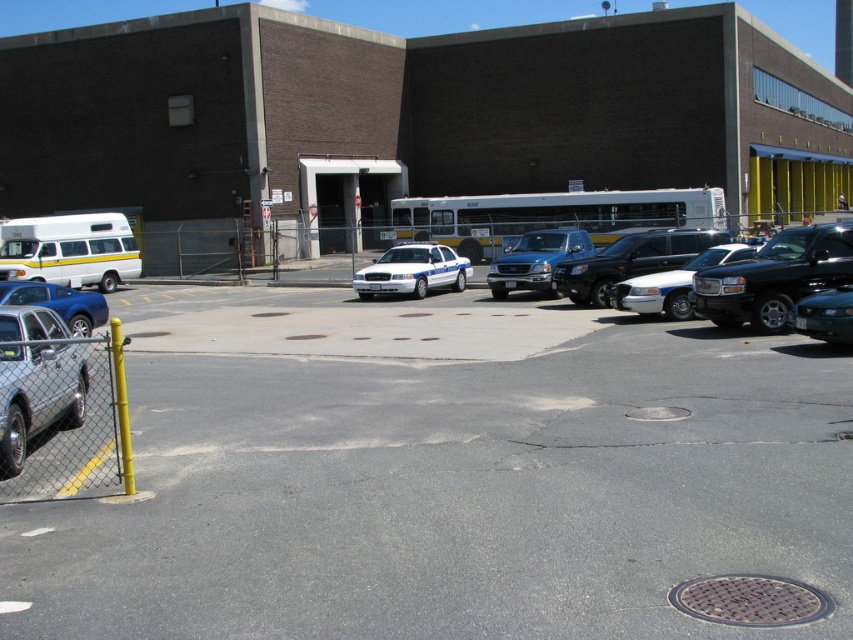
Consider the image. You are standing in front of the industrial building and want to walk to the satin black truck at center. Is the gray asphalt parking lot at center between you and the truck?

Yes, the gray asphalt parking lot at center is between you and the satin black truck at center because the parking lot is closer to the viewer than the truck.

You are a delivery driver who needs to exit the parking lot. You see the silver metallic sedan at left and the white matte van at left. Which vehicle is blocking your path closer to you?

The silver metallic sedan at left is blocking your path closer to you because it is in front of the white matte van at left.

You are a delivery driver who needs to park your 2.5 meter tall truck in the parking lot. Based on the scene, can your truck fit vertically in the parking space between the gray asphalt parking lot at center and the satin black truck at center?

The gray asphalt parking lot at center is much taller than the satin black truck at center, so the parking space between them has enough vertical clearance for your 2.5 meter tall truck to fit.